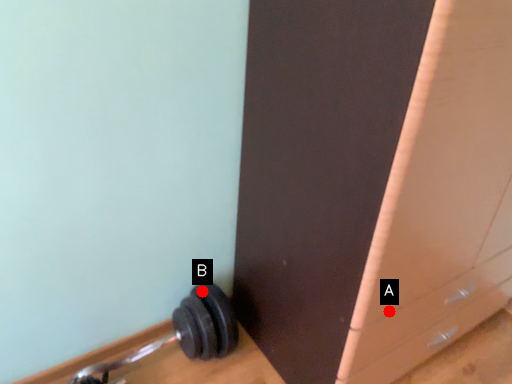
Question: Two points are circled on the image, labeled by A and B beside each circle. Among these points, which one is farthest from the camera?

Choices:
 (A) A is further
 (B) B is further

Answer: (B)